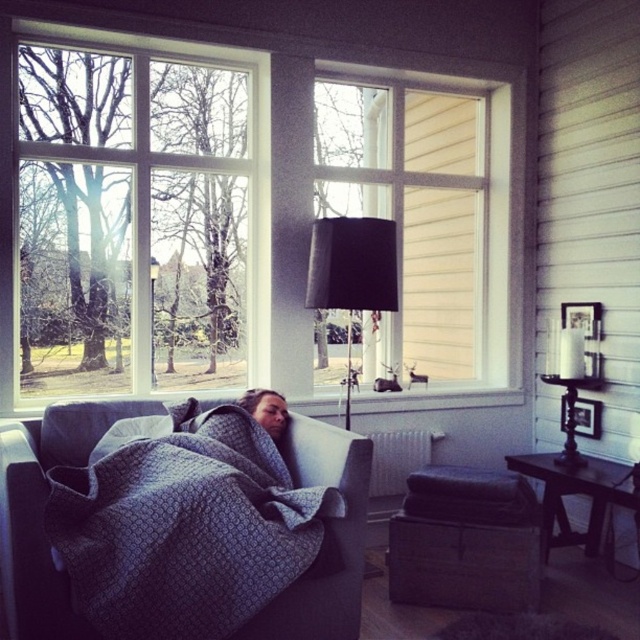
You are a delivery person trying to determine the best way to enter the room without disturbing the person on the sofa. The clear glass window at upper left and the dark gray quilted blanket at center are visible from outside. Which object would allow you to see inside the room more clearly?

The clear glass window at upper left would provide a clearer view inside the room compared to the dark gray quilted blanket at center since windows are typically transparent and designed for visibility, while blankets are opaque and cover surfaces.

You are a window cleaner who needs to clean both the matte white window at center and the white matte radiator at center. Which object requires a larger cleaning area?

The matte white window at center requires a larger cleaning area because it has a larger size compared to the white matte radiator at center.

You are standing in the room and want to look outside through the clear glass window at upper left. However, there is a dark gray quilted blanket at center in your way. Can you move the blanket to get a better view?

The clear glass window at upper left is above the dark gray quilted blanket at center, so you can simply move the blanket out of the way to have an unobstructed view through the window.